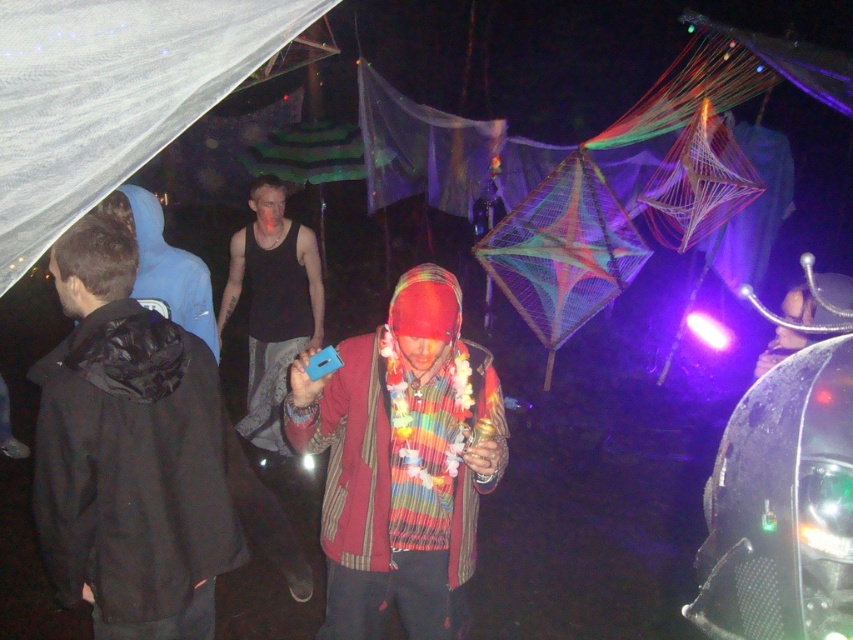
Can you confirm if striped fabric scarf at center is smaller than black tank top at center?

Yes.

Between striped fabric scarf at center and black tank top at center, which one is positioned lower?

striped fabric scarf at center is lower down.

At what (x,y) coordinates should I click in order to perform the action: click on striped fabric scarf at center. Please return your answer as a coordinate pair (x, y). The height and width of the screenshot is (640, 853). Looking at the image, I should click on (399, 460).

Between black matte jacket at center and striped fabric scarf at center, which one is positioned lower?

striped fabric scarf at center is below.

Locate an element on the screen. black matte jacket at center is located at coordinates pyautogui.click(x=131, y=452).

At what (x,y) coordinates should I click in order to perform the action: click on black matte jacket at center. Please return your answer as a coordinate pair (x, y). The image size is (853, 640). Looking at the image, I should click on [x=131, y=452].

Does black matte jacket at center appear on the left side of black tank top at center?

No, black matte jacket at center is not to the left of black tank top at center.

The height and width of the screenshot is (640, 853). What do you see at coordinates (131, 452) in the screenshot?
I see `black matte jacket at center` at bounding box center [131, 452].

Find the location of a particular element. black matte jacket at center is located at coordinates [131, 452].